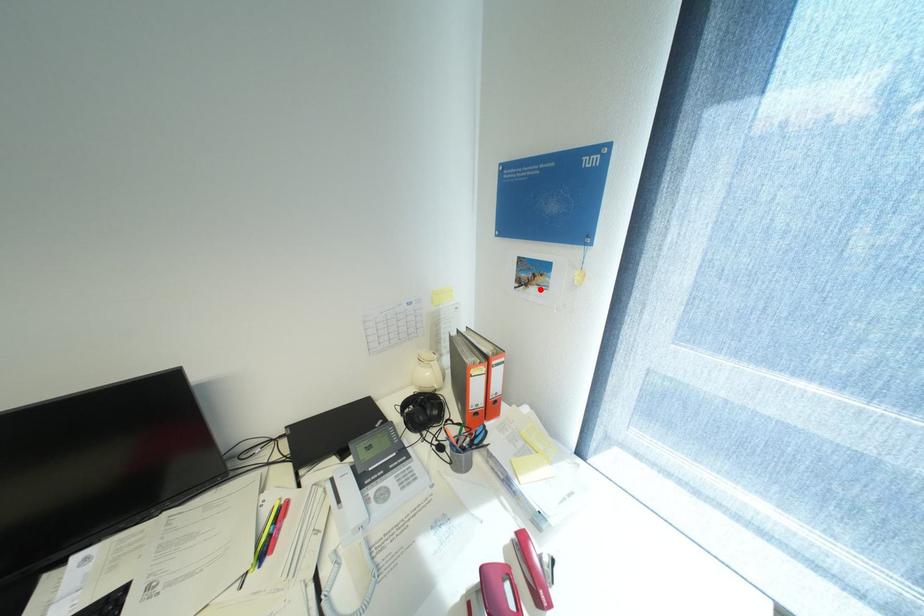
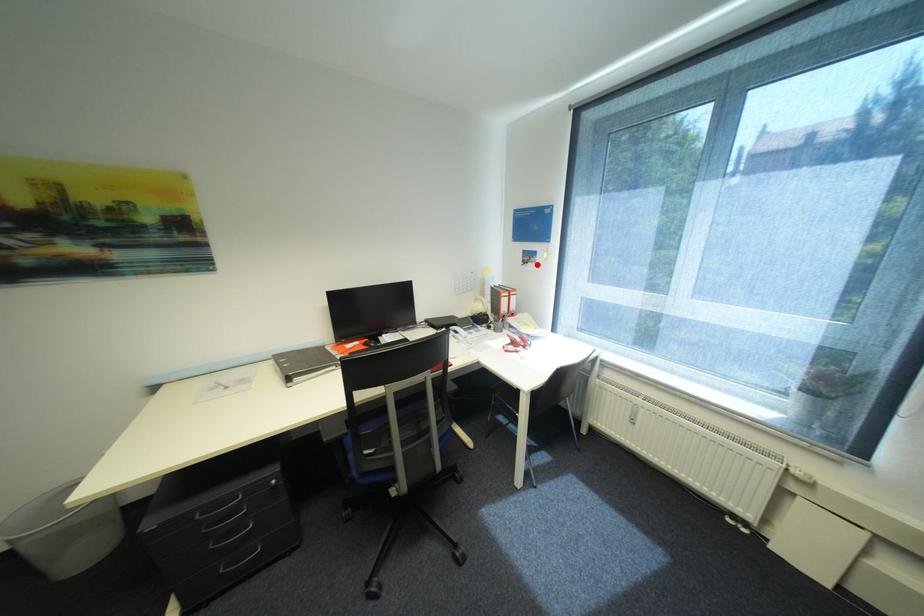
I am providing you with two images of the same scene from different viewpoints. A red point is marked on the first image and another point is marked on the second image. Is the red point in image1 aligned with the point shown in image2?

Yes